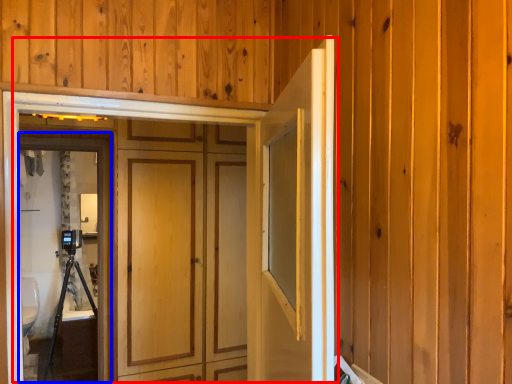
Question: Which point is further to the camera, door (highlighted by a red box) or screen door (highlighted by a blue box)?

Choices:
 (A) door
 (B) screen door

Answer: (B)